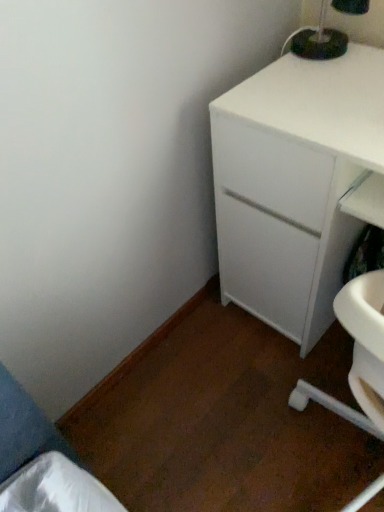
Question: In terms of size, does white matte cabinet at upper right appear bigger or smaller than black plastic lamp at upper right?

Choices:
 (A) small
 (B) big

Answer: (B)

Question: Which is correct: white matte cabinet at upper right is inside black plastic lamp at upper right, or outside of it?

Choices:
 (A) outside
 (B) inside

Answer: (A)

Question: In terms of height, does white matte cabinet at upper right look taller or shorter compared to black plastic lamp at upper right?

Choices:
 (A) tall
 (B) short

Answer: (A)

Question: In terms of height, does black plastic lamp at upper right look taller or shorter compared to white matte cabinet at upper right?

Choices:
 (A) short
 (B) tall

Answer: (A)

Question: Relative to white matte cabinet at upper right, is black plastic lamp at upper right in front or behind?

Choices:
 (A) front
 (B) behind

Answer: (B)

Question: From the image's perspective, is black plastic lamp at upper right above or below white matte cabinet at upper right?

Choices:
 (A) below
 (B) above

Answer: (B)

Question: Considering the positions of black plastic lamp at upper right and white matte cabinet at upper right in the image, is black plastic lamp at upper right wider or thinner than white matte cabinet at upper right?

Choices:
 (A) wide
 (B) thin

Answer: (B)